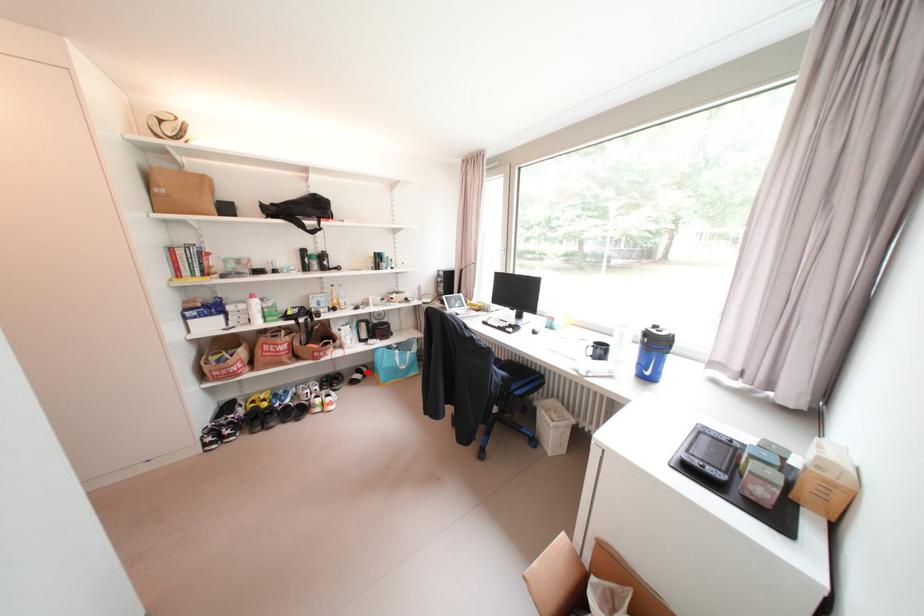
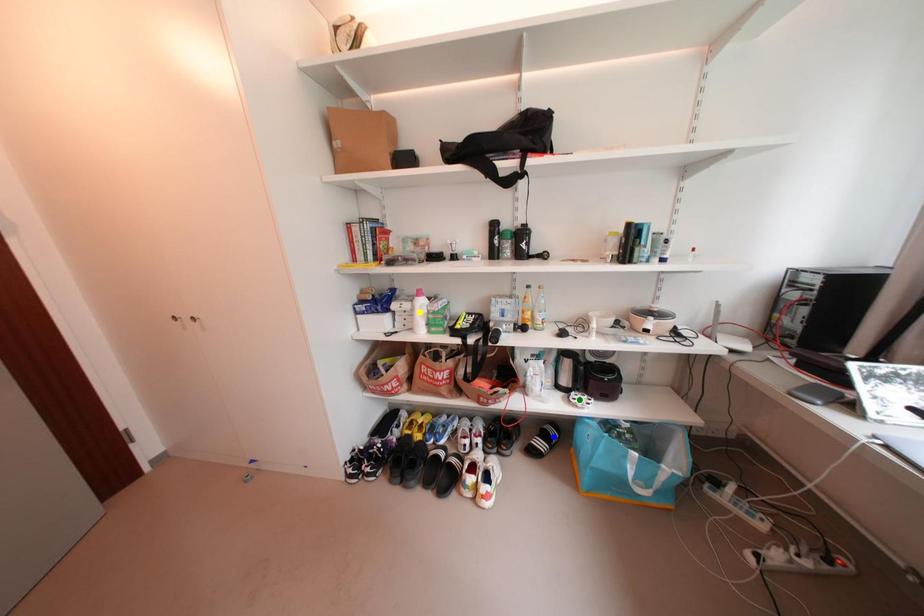
Question: I am providing you with two images of the same scene from different viewpoints. A red point is marked on the first image. You are given multiple points on the second image. Can you choose the point in image 2 that corresponds to the point in image 1?

Choices:
 (A) green point
 (B) blue point
 (C) yellow point

Answer: (B)